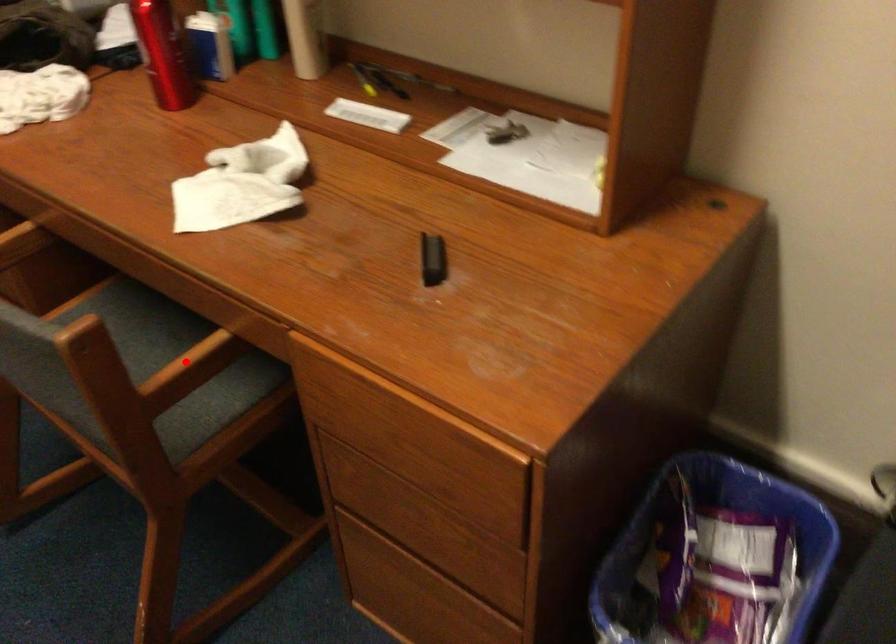
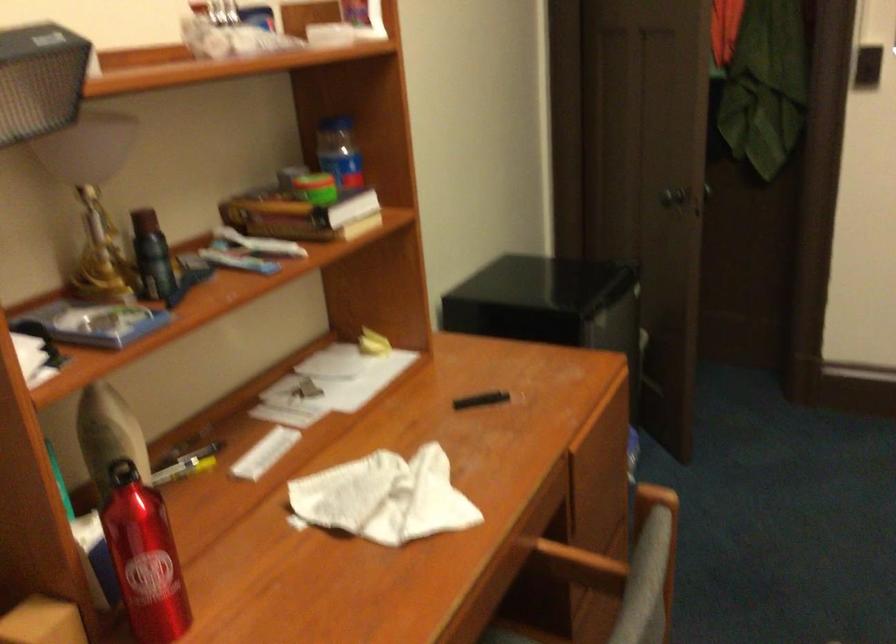
Find the pixel in the second image that matches the highlighted location in the first image.

(579, 565)